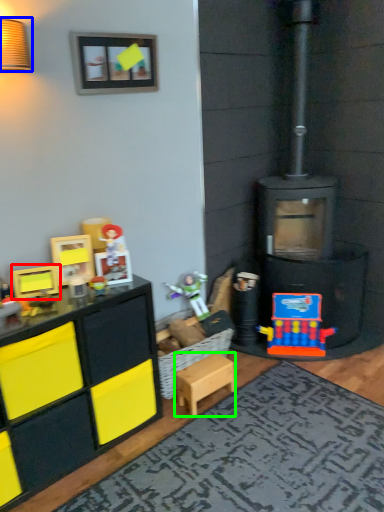
Question: Considering the real-world distances, which object is farthest from toy (highlighted by a red box)? lamp (highlighted by a blue box) or toy (highlighted by a green box)?

Choices:
 (A) lamp
 (B) toy

Answer: (A)